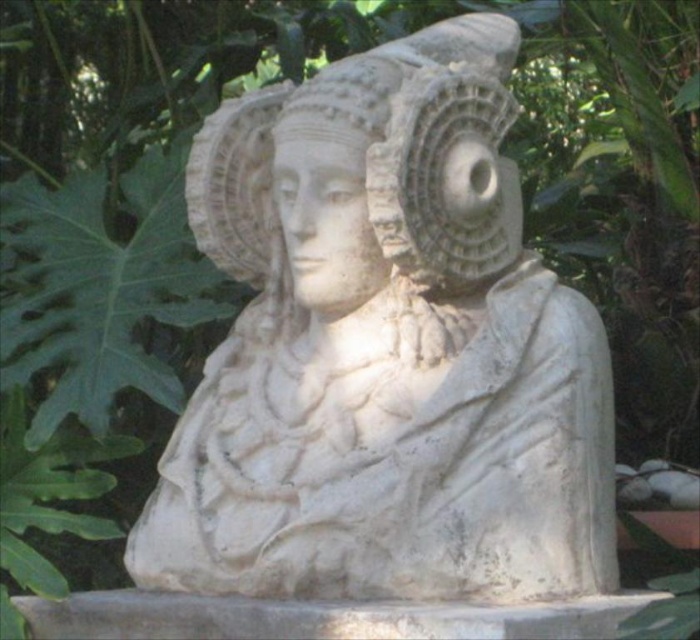
You are standing in front of a classical marble bust sculpture surrounded by greenery. You notice a specific point marked at coordinates (385, 352). What object is located at this point?

The point at coordinates (385, 352) corresponds to the white marble bust at center.